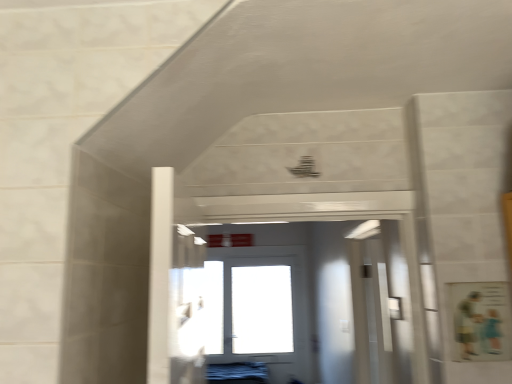
Question: From the image's perspective, is white glossy door at center, which is the first door from back to front, positioned above or below white glossy door at center, marked as the first door in a front-to-back arrangement?

Choices:
 (A) below
 (B) above

Answer: (A)

Question: Visually, is white glossy door at center, which is counted as the 2th door, starting from the front, positioned to the left or to the right of white glossy door at center, placed as the 2th door when sorted from bottom to top?

Choices:
 (A) left
 (B) right

Answer: (A)

Question: Is white glossy door at center, which is the first door from back to front, bigger or smaller than white glossy door at center, the 2th door when ordered from back to front?

Choices:
 (A) small
 (B) big

Answer: (B)

Question: Considering the positions of point (209, 302) and point (230, 299), is point (209, 302) closer or farther from the camera than point (230, 299)?

Choices:
 (A) closer
 (B) farther

Answer: (A)

Question: Is white glossy door at center, the 2th door when ordered from back to front, spatially inside white glossy door at center, which is the first door from back to front, or outside of it?

Choices:
 (A) outside
 (B) inside

Answer: (A)

Question: Is white glossy door at center, the 1th door from the top, taller or shorter than white glossy door at center, arranged as the first door when ordered from the bottom?

Choices:
 (A) tall
 (B) short

Answer: (B)

Question: Would you say white glossy door at center, the 1th door from the top, is to the left or to the right of white glossy door at center, arranged as the 2th door when viewed from the top, in the picture?

Choices:
 (A) right
 (B) left

Answer: (A)